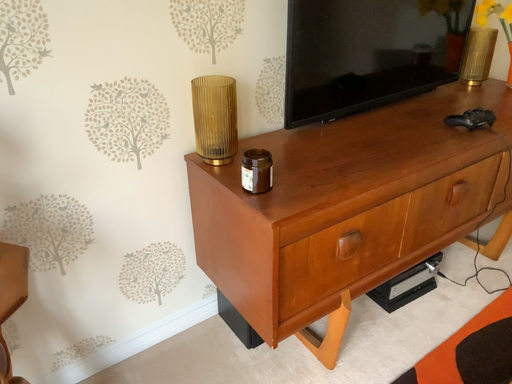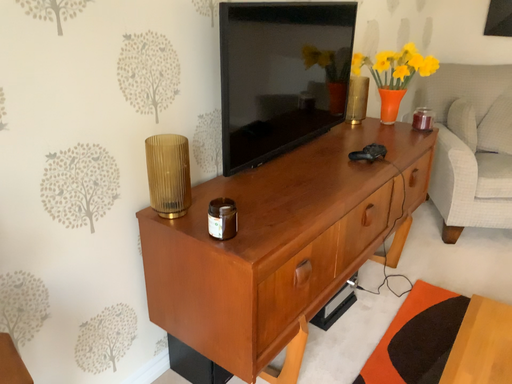
Question: How did the camera likely rotate when shooting the video?

Choices:
 (A) rotated downward
 (B) rotated upward

Answer: (B)